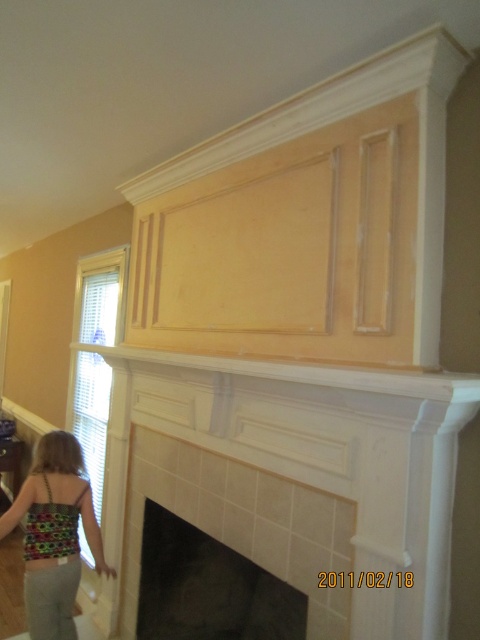
Question: Is black glass fireplace at center to the left of multicolored fabric dress at lower left from the viewer's perspective?

Choices:
 (A) yes
 (B) no

Answer: (B)

Question: Which point is closer to the camera?

Choices:
 (A) (78, 509)
 (B) (188, 568)

Answer: (A)

Question: Which point is farther from the camera taking this photo?

Choices:
 (A) (80, 476)
 (B) (170, 552)

Answer: (B)

Question: Is black glass fireplace at center further to the viewer compared to multicolored fabric dress at lower left?

Choices:
 (A) no
 (B) yes

Answer: (A)

Question: Is black glass fireplace at center positioned before multicolored fabric dress at lower left?

Choices:
 (A) no
 (B) yes

Answer: (B)